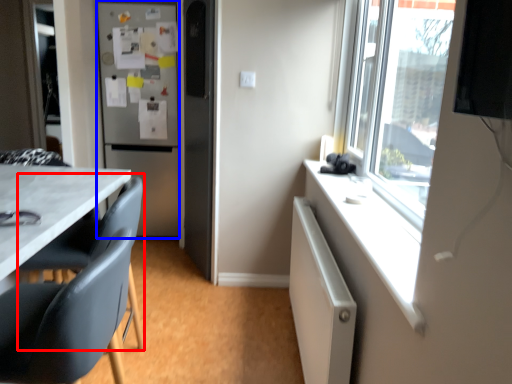
Question: Which object is closer to the camera taking this photo, swivel chair (highlighted by a red box) or refrigerator (highlighted by a blue box)?

Choices:
 (A) swivel chair
 (B) refrigerator

Answer: (A)